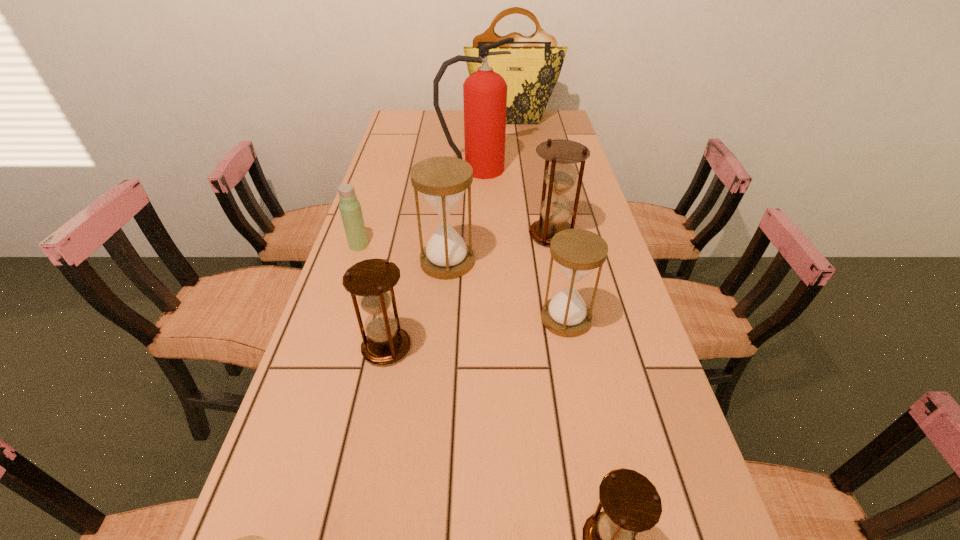
The height and width of the screenshot is (540, 960). Identify the location of tote bag. tap(531, 71).

Find the location of `the farthest object`. the farthest object is located at coordinates (531, 71).

Find the location of a particular element. fire extinguisher is located at coordinates (484, 92).

Locate an element on the screen. the eighth nearest object is located at coordinates (484, 92).

The image size is (960, 540). Find the location of `the farthest brown hourglass`. the farthest brown hourglass is located at coordinates (560, 176).

Where is `the farthest white hourglass`? The height and width of the screenshot is (540, 960). the farthest white hourglass is located at coordinates (442, 181).

You are a GUI agent. You are given a task and a screenshot of the screen. Output one action in this format:
    pyautogui.click(x=<x>, y=<y>)
    Task: Click on the biggest white hourglass
    
    Given the screenshot: What is the action you would take?
    pyautogui.click(x=442, y=181)

Find the location of a particular element. The height and width of the screenshot is (540, 960). the rightmost white hourglass is located at coordinates (578, 252).

This screenshot has height=540, width=960. In order to click on the second farthest white hourglass in this screenshot , I will do `click(578, 252)`.

Where is `the second farthest brown hourglass`? This screenshot has width=960, height=540. the second farthest brown hourglass is located at coordinates (372, 280).